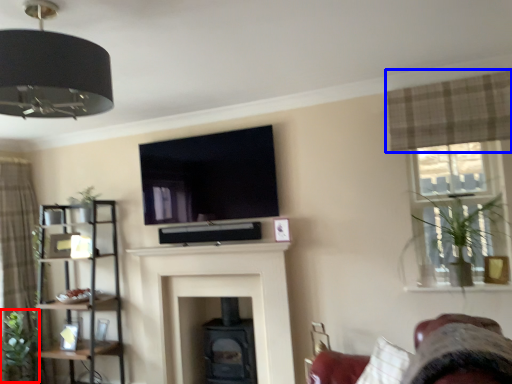
Question: Which object appears closest to the camera in this image, plant (highlighted by a red box) or curtain (highlighted by a blue box)?

Choices:
 (A) plant
 (B) curtain

Answer: (B)